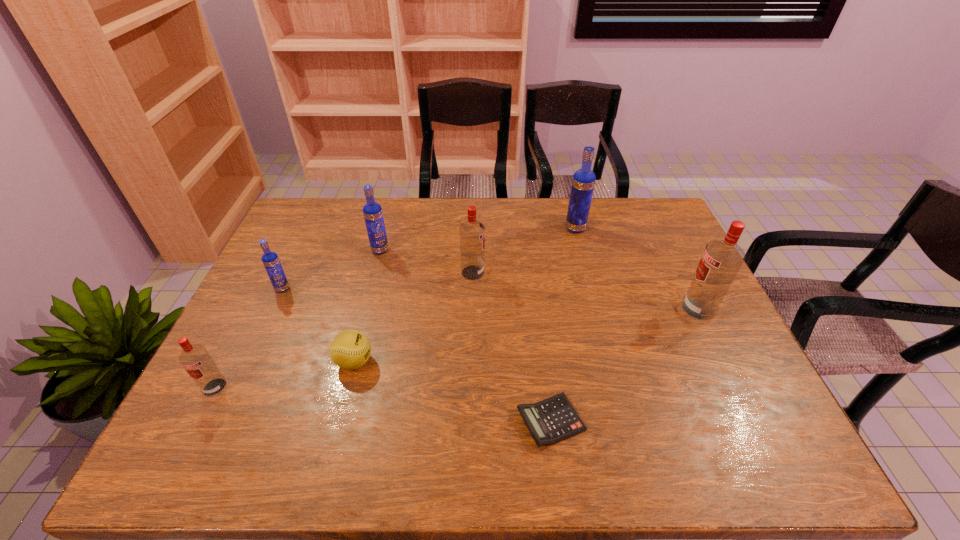
The width and height of the screenshot is (960, 540). Find the location of `vacant space at the near edge`. vacant space at the near edge is located at coordinates (371, 460).

Identify the location of free space at the left edge of the desktop. This screenshot has height=540, width=960. (300, 258).

Where is `blank space at the right edge of the desktop`? blank space at the right edge of the desktop is located at coordinates (671, 277).

Identify the location of vacant space at the far left corner of the desktop. (327, 238).

Image resolution: width=960 pixels, height=540 pixels. In order to click on free space between the second blue vodka from right to left and the smallest blue vodka in this screenshot , I will do `click(331, 269)`.

Where is `free space between the rightmost vodka and the second red vodka from right to left`? The height and width of the screenshot is (540, 960). free space between the rightmost vodka and the second red vodka from right to left is located at coordinates (586, 291).

Identify the location of vacant region between the rightmost vodka and the leftmost red vodka. The image size is (960, 540). (457, 348).

At what (x,y) coordinates should I click in order to perform the action: click on free point between the fifth nearest object and the nearest vodka. Please return your answer as a coordinate pair (x, y). The height and width of the screenshot is (540, 960). Looking at the image, I should click on (249, 338).

Locate an element on the screen. free spot between the leftmost blue vodka and the shortest object is located at coordinates (417, 355).

The image size is (960, 540). Find the location of `vacant area between the sixth nearest object and the rightmost red vodka`. vacant area between the sixth nearest object and the rightmost red vodka is located at coordinates (586, 291).